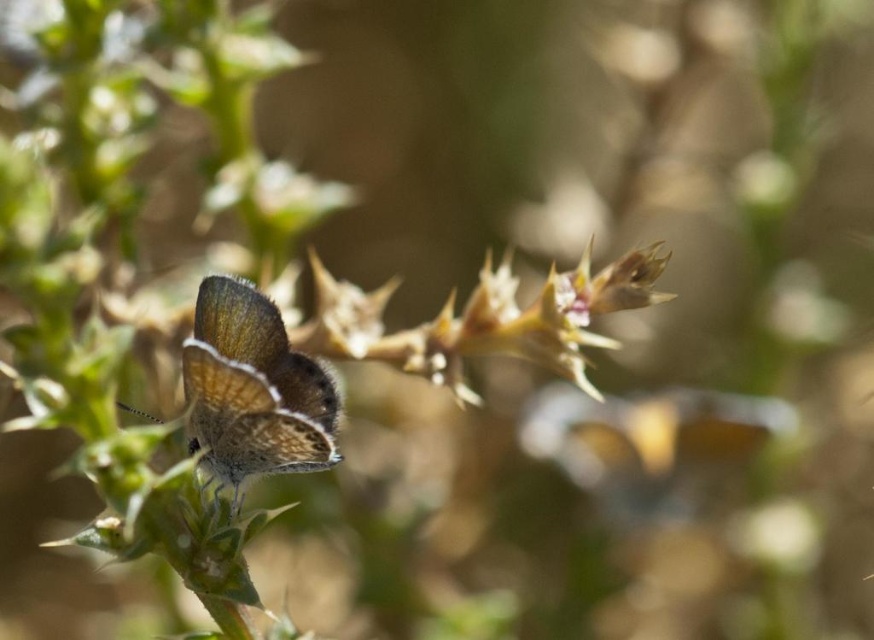
Question: From the image, what is the correct spatial relationship of brown spiny thorn at center in relation to satin brown butterfly at center?

Choices:
 (A) right
 (B) left

Answer: (A)

Question: Can you confirm if brown spiny thorn at center is wider than satin brown butterfly at center?

Choices:
 (A) yes
 (B) no

Answer: (A)

Question: Which point is closer to the camera taking this photo?

Choices:
 (A) (330, 442)
 (B) (586, 304)

Answer: (A)

Question: Is brown spiny thorn at center smaller than satin brown butterfly at center?

Choices:
 (A) no
 (B) yes

Answer: (A)

Question: Among these points, which one is nearest to the camera?

Choices:
 (A) (226, 296)
 (B) (425, 342)

Answer: (A)